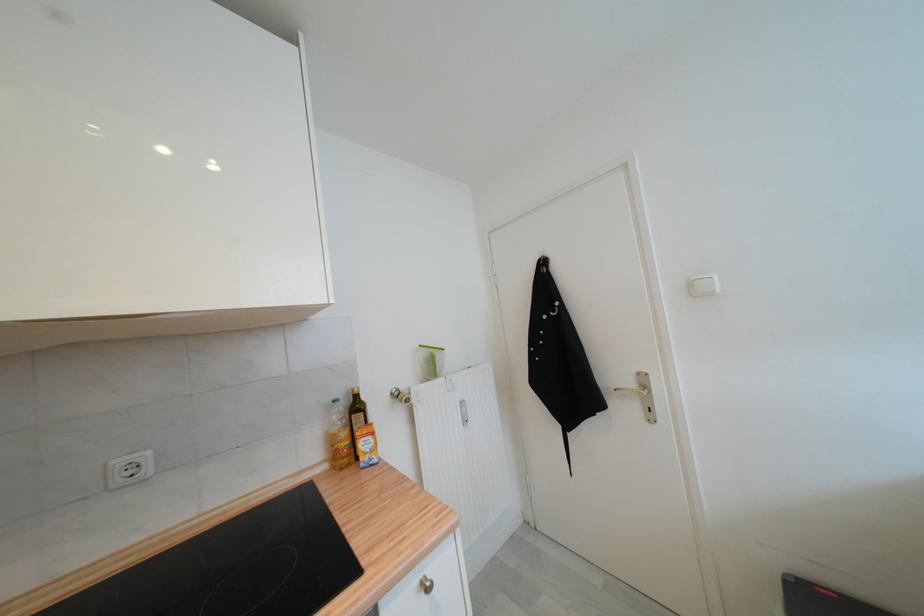
The height and width of the screenshot is (616, 924). What do you see at coordinates (426, 584) in the screenshot? I see `a round cabinet knob` at bounding box center [426, 584].